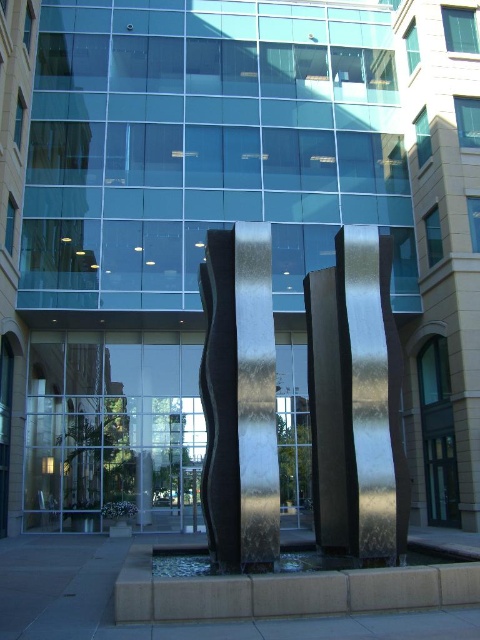
You are an art curator planning to move the polished bronze sculpture at center and the polished black sculpture at center to a new gallery. The gallery has a 1.5 meter wide doorway. Which sculpture would you move first to ensure it fits through the doorway?

The polished bronze sculpture at center has a smaller width than the polished black sculpture at center. Since the doorway is 1.5 meters wide, you should move the polished bronze sculpture at center first to ensure it fits through the doorway before attempting the wider polished black sculpture at center.

You are standing in front of the glass building and want to walk from the point at coordinates point (368, 256) to the point at coordinates point (231, 300). Which direction should you move in relation to the sculpture?

You should move towards the sculpture because point (368, 256) is behind point (231, 300), meaning the latter is closer to you. Since the sculpture is in front of the building, moving toward it would bring you closer to point (231, 300).